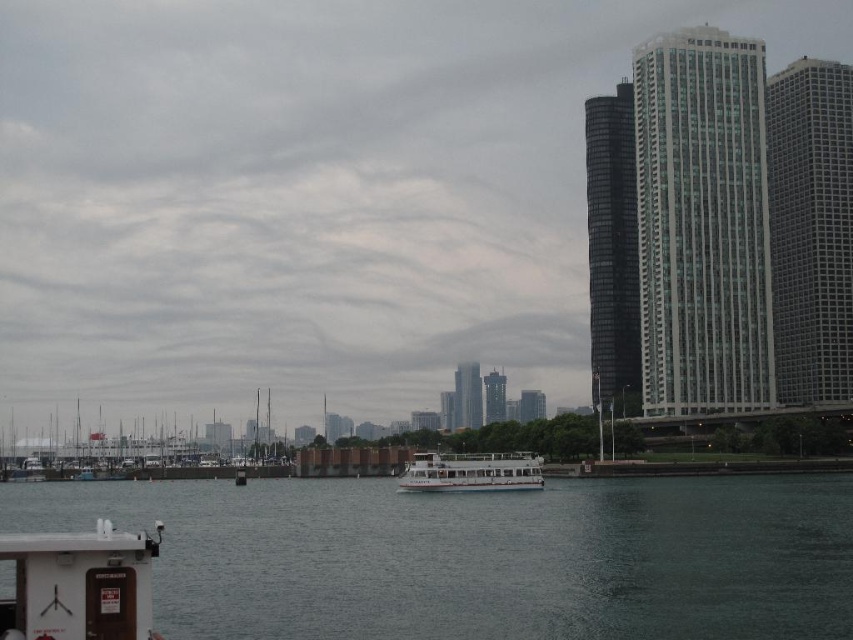
Does point (358, 620) come in front of point (485, 465)?

Yes, it is in front of point (485, 465).

Is point (418, 525) positioned after point (505, 456)?

No, it is in front of (505, 456).

Find the location of `dark gray water at center`. dark gray water at center is located at coordinates (480, 556).